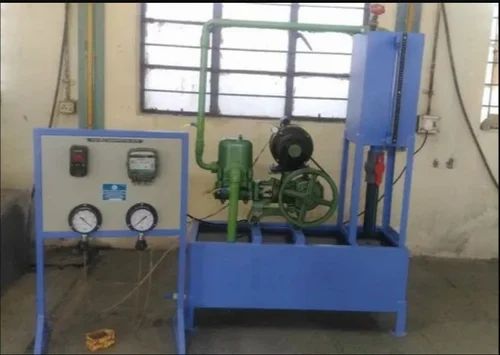
In order to click on cables in this screenshot , I will do `click(138, 284)`, `click(85, 271)`, `click(141, 258)`, `click(218, 211)`, `click(381, 198)`, `click(262, 149)`, `click(60, 81)`, `click(426, 141)`, `click(465, 109)`.